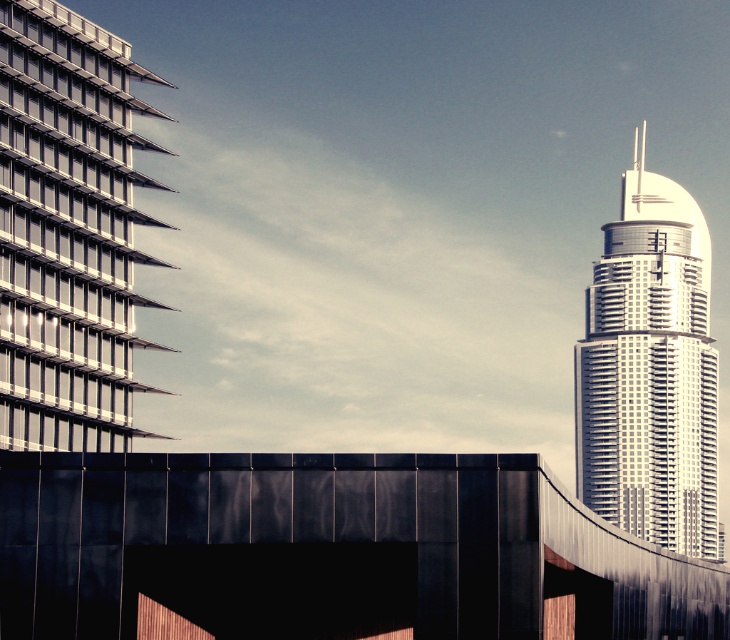
You are standing in the middle of the urban landscape and want to take a photo of both the metallic glass skyscraper at left and the silver glass skyscraper at right. Which skyscraper appears lower in the photo?

The metallic glass skyscraper at left appears lower in the photo because it is located below the silver glass skyscraper at right.

You are an architect evaluating two skyscrapers in the city. The metallic glass skyscraper at left and the silver glass skyscraper at right. Which one has a greater height?

The silver glass skyscraper at right is taller than the metallic glass skyscraper at left.